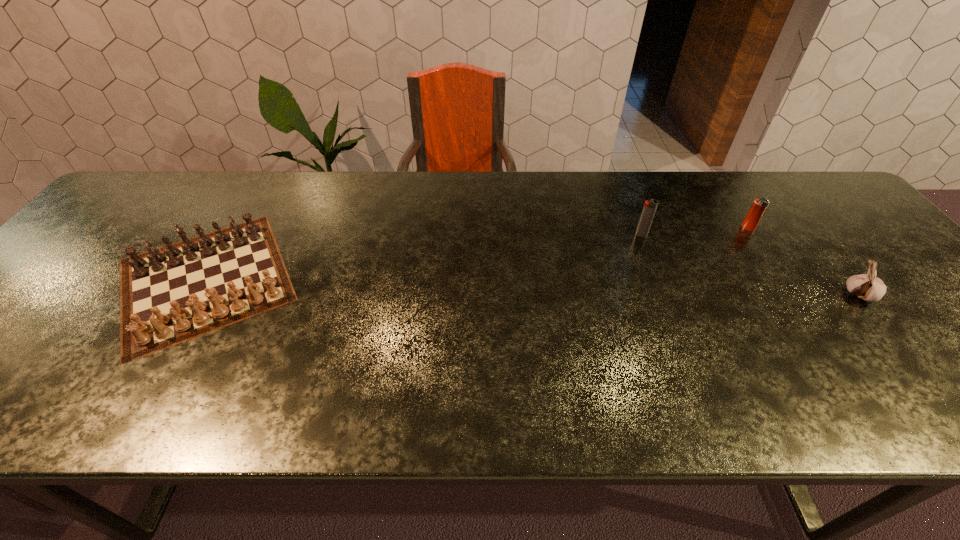
Locate an element on the screen. The image size is (960, 540). empty space that is in between the rightmost object and the chessboard is located at coordinates (532, 287).

Locate an element on the screen. The height and width of the screenshot is (540, 960). blank region between the leftmost object and the third object from left to right is located at coordinates (476, 253).

At what (x,y) coordinates should I click in order to perform the action: click on vacant space that's between the leftmost object and the rightmost object. Please return your answer as a coordinate pair (x, y). This screenshot has width=960, height=540. Looking at the image, I should click on point(532,287).

The image size is (960, 540). Identify the location of vacant point located between the right igniter and the chessboard. (476, 253).

Identify the location of vacant region between the chessboard and the garlic. (532, 287).

This screenshot has height=540, width=960. Find the location of `free space between the garlic and the leftmost object`. free space between the garlic and the leftmost object is located at coordinates tap(532, 287).

The height and width of the screenshot is (540, 960). I want to click on free space between the garlic and the right igniter, so click(804, 262).

Where is `free area in between the nearer igniter and the chessboard`? The image size is (960, 540). free area in between the nearer igniter and the chessboard is located at coordinates (423, 257).

Locate an element on the screen. The width and height of the screenshot is (960, 540). free space between the right igniter and the chessboard is located at coordinates (476, 253).

Locate which object is the closest to the chessboard. Please provide its 2D coordinates. Your answer should be formatted as a tuple, i.e. [(x, y)], where the tuple contains the x and y coordinates of a point satisfying the conditions above.

[(649, 209)]